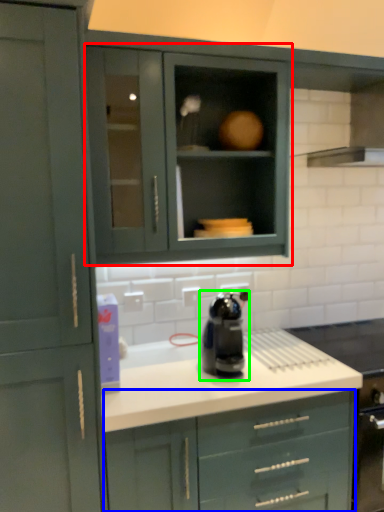
Question: Considering the real-world distances, which object is closest to cabinetry (highlighted by a red box)? cabinetry (highlighted by a blue box) or home appliance (highlighted by a green box).

Choices:
 (A) cabinetry
 (B) home appliance

Answer: (B)